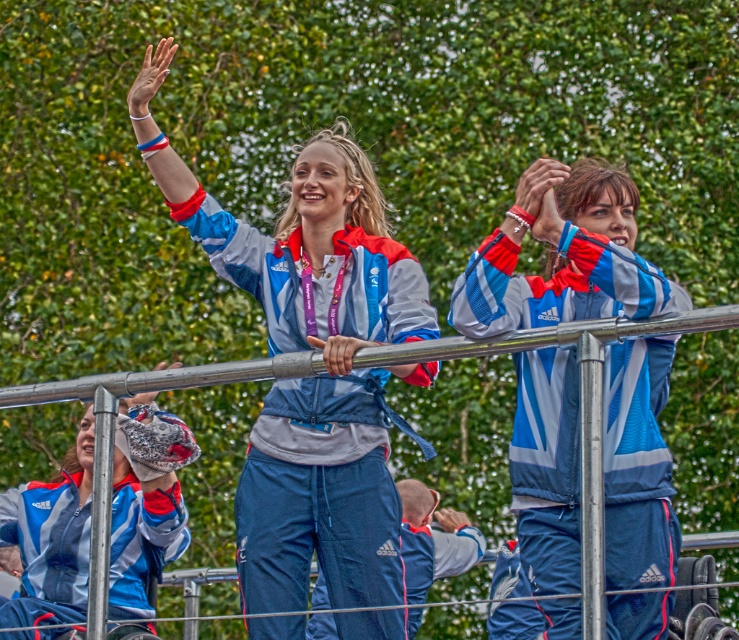
Which is above, matte blue tracksuit at center or blue reflective jacket at center?

Positioned higher is matte blue tracksuit at center.

Who is more distant from viewer, [299,428] or [517,250]?

The point [299,428] is more distant.

Is point (303, 163) positioned behind point (624, 212)?

Yes, it is behind point (624, 212).

Locate an element on the screen. The height and width of the screenshot is (640, 739). matte blue tracksuit at center is located at coordinates (321, 358).